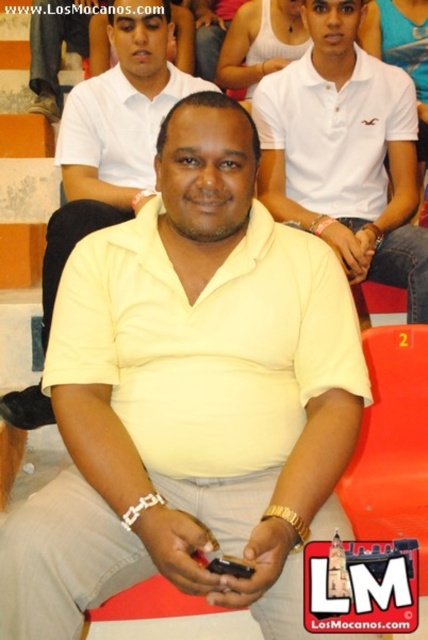
Find the location of `white matte polo shirt at center`. white matte polo shirt at center is located at coordinates (345, 152).

Find the location of a particular element. The width and height of the screenshot is (428, 640). white matte polo shirt at center is located at coordinates (345, 152).

Identify the location of white matte polo shirt at center. The height and width of the screenshot is (640, 428). (345, 152).

Between point (412, 193) and point (53, 108), which one is positioned in front?

Point (412, 193)

Based on the photo, does white matte polo shirt at center have a greater height compared to matte black shoe at upper left?

Indeed, white matte polo shirt at center has a greater height compared to matte black shoe at upper left.

Between point (291, 125) and point (38, 56), which one is positioned in front?

Positioned in front is point (291, 125).

At what (x,y) coordinates should I click in order to perform the action: click on white matte polo shirt at center. Please return your answer as a coordinate pair (x, y). Looking at the image, I should click on (345, 152).

Is yellow matte shirt at center closer to the viewer compared to matte black shoe at upper left?

Yes, yellow matte shirt at center is closer to the viewer.

Is point (47, 276) positioned before point (74, 4)?

Yes, point (47, 276) is closer to viewer.

Locate an element on the screen. yellow matte shirt at center is located at coordinates click(x=112, y=134).